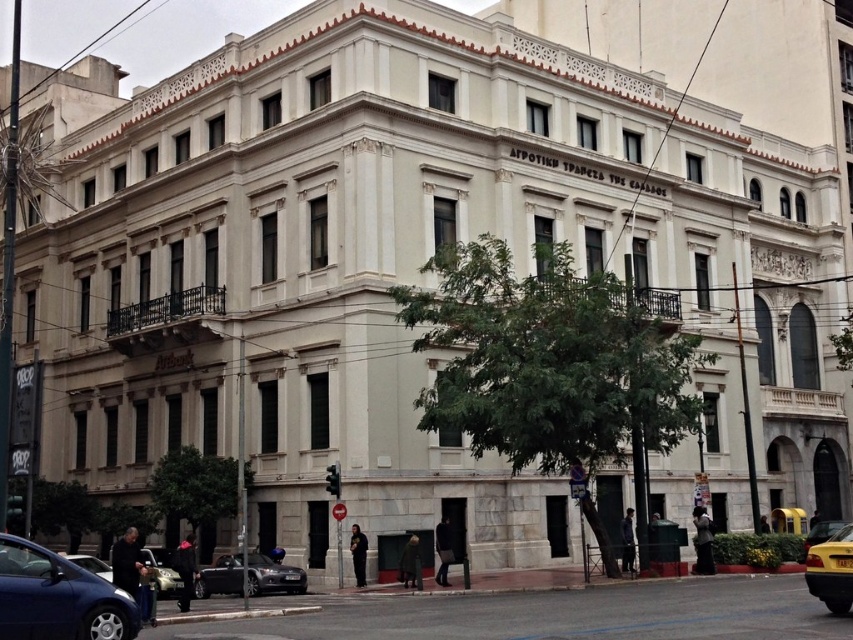
Question: Which point is farther to the camera?

Choices:
 (A) (200, 589)
 (B) (805, 548)
 (C) (41, 630)

Answer: (B)

Question: Which point is farther from the camera taking this photo?

Choices:
 (A) (792, 516)
 (B) (32, 596)
 (C) (222, 589)
 (D) (834, 577)

Answer: (A)

Question: Observing the image, what is the correct spatial positioning of shiny black car at lower left in reference to yellow metallic taxi at lower right?

Choices:
 (A) above
 (B) below

Answer: (A)

Question: Is matte silver car at lower left positioned at the back of yellow matte taxi at center?

Choices:
 (A) yes
 (B) no

Answer: (B)

Question: Which of these objects is positioned closest to the shiny black car at lower left?

Choices:
 (A) yellow matte taxi at center
 (B) yellow rubber taxi at lower right

Answer: (B)

Question: Does matte blue car at lower left have a greater width compared to matte silver car at lower left?

Choices:
 (A) no
 (B) yes

Answer: (A)